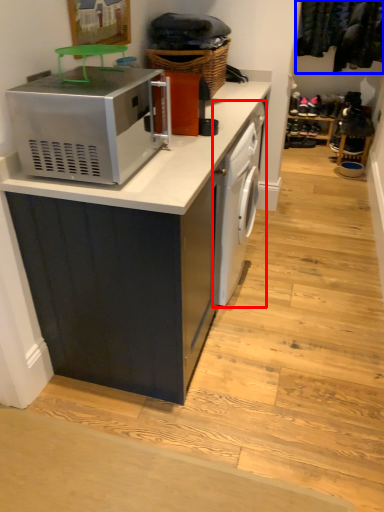
Question: Among these objects, which one is farthest to the camera, dish washer (highlighted by a red box) or laundry (highlighted by a blue box)?

Choices:
 (A) dish washer
 (B) laundry

Answer: (B)